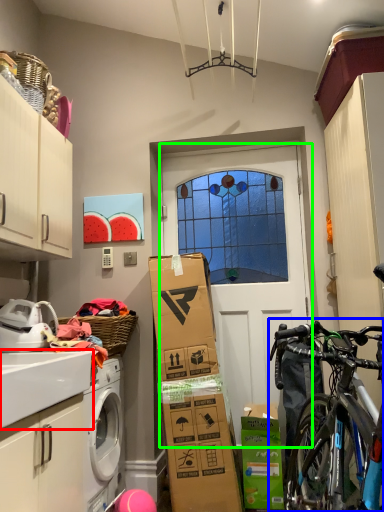
Question: Considering the real-world distances, which object is closest to counter top (highlighted by a red box)? bicycle (highlighted by a blue box) or door (highlighted by a green box).

Choices:
 (A) bicycle
 (B) door

Answer: (A)